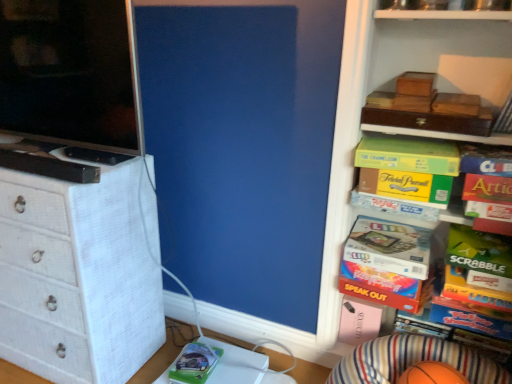
Question: Can you confirm if orange rubber basketball at lower right is thinner than wooden boxes at upper right?

Choices:
 (A) no
 (B) yes

Answer: (A)

Question: From the image's perspective, would you say orange rubber basketball at lower right is shown under wooden boxes at upper right?

Choices:
 (A) no
 (B) yes

Answer: (B)

Question: Are orange rubber basketball at lower right and wooden boxes at upper right making contact?

Choices:
 (A) yes
 (B) no

Answer: (B)

Question: Is orange rubber basketball at lower right completely or partially outside of wooden boxes at upper right?

Choices:
 (A) yes
 (B) no

Answer: (A)

Question: Is orange rubber basketball at lower right to the left of wooden boxes at upper right from the viewer's perspective?

Choices:
 (A) yes
 (B) no

Answer: (A)

Question: Is matte black screen at left bigger or smaller than wooden box at upper right, the 1th storage box when ordered from top to bottom?

Choices:
 (A) big
 (B) small

Answer: (A)

Question: Considering their positions, is matte black screen at left located in front of or behind wooden box at upper right, the 1th storage box when ordered from top to bottom?

Choices:
 (A) front
 (B) behind

Answer: (A)

Question: From a real-world perspective, is matte black screen at left physically located above or below wooden box at upper right, positioned as the 2th storage box in bottom-to-top order?

Choices:
 (A) above
 (B) below

Answer: (A)

Question: Is matte black screen at left wider or thinner than wooden box at upper right, the 1th storage box when ordered from top to bottom?

Choices:
 (A) thin
 (B) wide

Answer: (A)

Question: From a real-world perspective, is green matte comic book at lower center above or below orange rubber basketball at lower right?

Choices:
 (A) below
 (B) above

Answer: (A)

Question: From the image's perspective, is green matte comic book at lower center above or below orange rubber basketball at lower right?

Choices:
 (A) below
 (B) above

Answer: (B)

Question: Considering the positions of green matte comic book at lower center and orange rubber basketball at lower right in the image, is green matte comic book at lower center bigger or smaller than orange rubber basketball at lower right?

Choices:
 (A) small
 (B) big

Answer: (A)

Question: Considering the positions of green matte comic book at lower center and orange rubber basketball at lower right in the image, is green matte comic book at lower center wider or thinner than orange rubber basketball at lower right?

Choices:
 (A) wide
 (B) thin

Answer: (B)

Question: Is white woven chest of drawers at left bigger or smaller than matte black screen at left?

Choices:
 (A) small
 (B) big

Answer: (B)

Question: Considering their positions, is white woven chest of drawers at left located in front of or behind matte black screen at left?

Choices:
 (A) behind
 (B) front

Answer: (A)